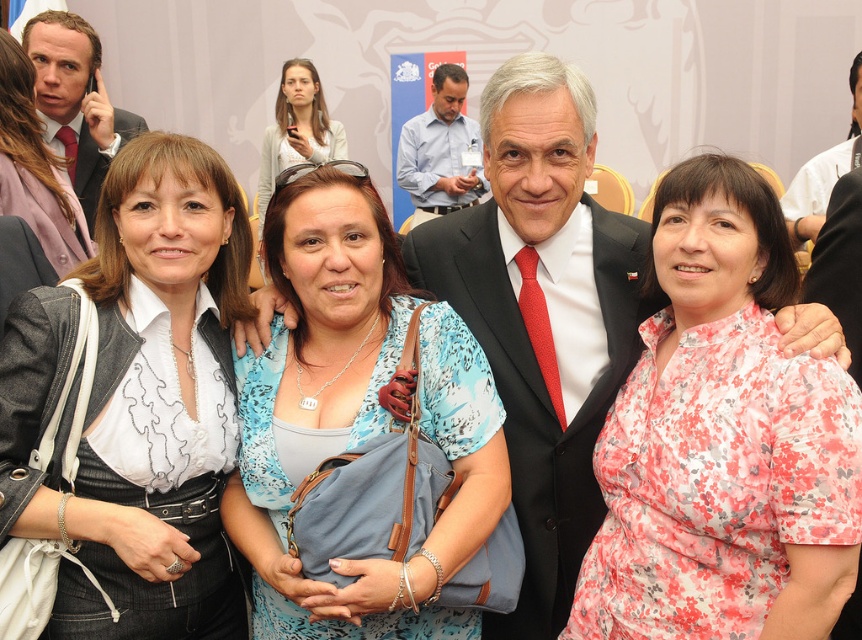
Is point (786, 493) closer to viewer compared to point (566, 388)?

That is True.

Is point (698, 204) positioned behind point (236, 324)?

No, it is not.

Which is behind, point (776, 442) or point (578, 499)?

The point (578, 499) is behind.

The image size is (862, 640). Identify the location of floral print blouse at center. (722, 440).

Where is `brushed metal suit at upper left`? This screenshot has width=862, height=640. brushed metal suit at upper left is located at coordinates (76, 100).

Measure the distance between point (89, 56) and camera.

Point (89, 56) is 3.56 meters from camera.

Identify the location of brushed metal suit at upper left. This screenshot has width=862, height=640. (76, 100).

The image size is (862, 640). What are the coordinates of `brushed metal suit at upper left` in the screenshot? It's located at (76, 100).

Who is lower down, matte black suit at center or matte white blouse at upper left?

matte black suit at center is below.

From the picture: Can you confirm if matte black suit at center is positioned below matte white blouse at upper left?

Yes, matte black suit at center is below matte white blouse at upper left.

The width and height of the screenshot is (862, 640). What do you see at coordinates (542, 317) in the screenshot? I see `matte black suit at center` at bounding box center [542, 317].

At what (x,y) coordinates should I click in order to perform the action: click on matte black suit at center. Please return your answer as a coordinate pair (x, y). Image resolution: width=862 pixels, height=640 pixels. Looking at the image, I should click on (542, 317).